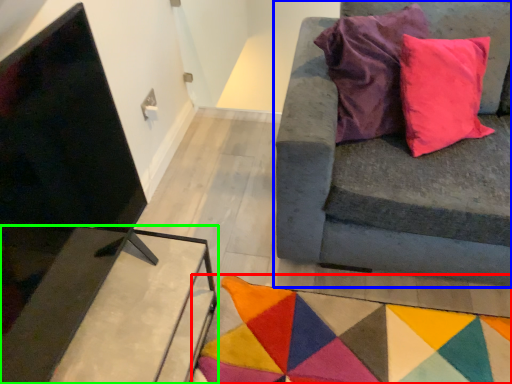
Question: Which object is the farthest from mat (highlighted by a red box)? Choose among these: studio couch (highlighted by a blue box) or table (highlighted by a green box).

Choices:
 (A) studio couch
 (B) table

Answer: (B)